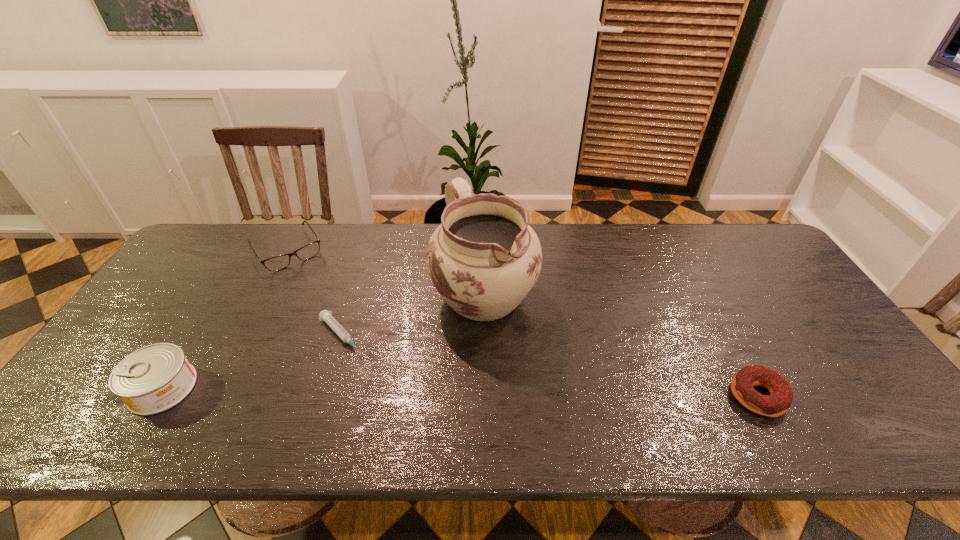
I want to click on vacant space located at the needle end of the syringe, so click(x=366, y=362).

At what (x,y) coordinates should I click in order to perform the action: click on blank area located at the needle end of the syringe. Please return your answer as a coordinate pair (x, y). The width and height of the screenshot is (960, 540). Looking at the image, I should click on click(x=366, y=362).

This screenshot has height=540, width=960. Find the location of `vacant region located on the lenses of the spectacles`. vacant region located on the lenses of the spectacles is located at coordinates [354, 352].

The width and height of the screenshot is (960, 540). I want to click on free space located on the lenses of the spectacles, so click(x=343, y=335).

Image resolution: width=960 pixels, height=540 pixels. Find the location of `free spot located on the lenses of the spectacles`. free spot located on the lenses of the spectacles is located at coordinates (340, 330).

At what (x,y) coordinates should I click in order to perform the action: click on blank space located 0.120m on the spout of the tallest object. Please return your answer as a coordinate pair (x, y). Looking at the image, I should click on (519, 371).

I want to click on vacant space situated on the spout of the tallest object, so click(x=533, y=398).

The width and height of the screenshot is (960, 540). I want to click on vacant region located on the spout of the tallest object, so click(x=533, y=398).

Image resolution: width=960 pixels, height=540 pixels. Identify the location of spectacles present at the far edge. (279, 262).

The image size is (960, 540). Identify the location of pitcher present at the far edge. (484, 259).